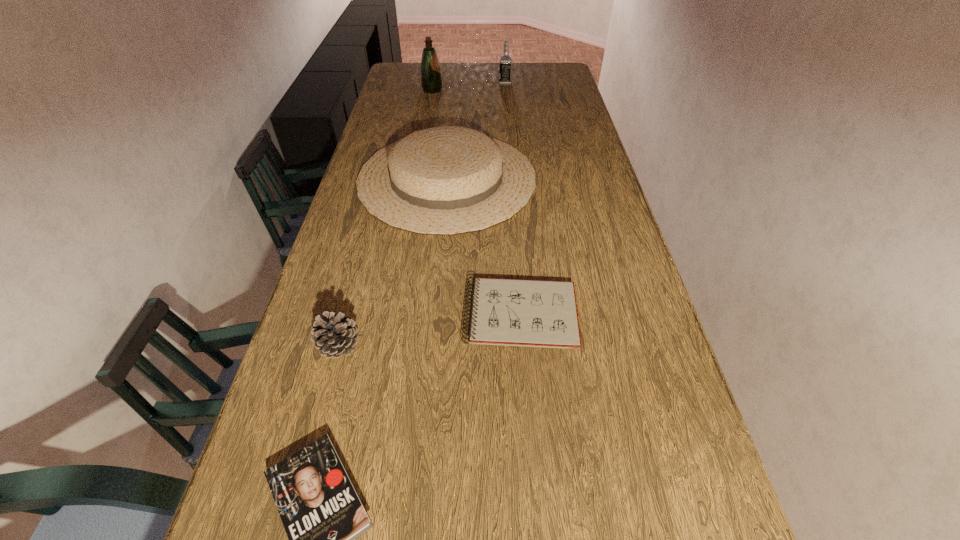
This screenshot has height=540, width=960. I want to click on blank space located 0.380m on the front label of the second tallest object, so click(416, 83).

You are a GUI agent. You are given a task and a screenshot of the screen. Output one action in this format:
    pyautogui.click(x=<x>, y=<y>)
    Task: Click on the free location located on the front of the sunhat
    The width and height of the screenshot is (960, 540).
    Given the screenshot: What is the action you would take?
    point(433,332)

Identify the location of vacant space situated on the front of the pinecone. The width and height of the screenshot is (960, 540). (326, 394).

At what (x,y) coordinates should I click in order to perform the action: click on vacant space located 0.200m on the back of the notepad. Please return your answer as a coordinate pair (x, y). The image size is (960, 540). Looking at the image, I should click on (514, 233).

Identify the location of object that is at the far edge. (505, 66).

Where is `olive oil that is at the left edge`? This screenshot has width=960, height=540. olive oil that is at the left edge is located at coordinates (431, 82).

At what (x,y) coordinates should I click in order to perform the action: click on sunhat situated at the left edge. Please return your answer as a coordinate pair (x, y). Looking at the image, I should click on (447, 180).

The width and height of the screenshot is (960, 540). In order to click on pinecone located at the left edge in this screenshot , I will do `click(335, 335)`.

In the image, there is a desktop. Find the location of `vacant space at the far edge`. vacant space at the far edge is located at coordinates (487, 75).

In the image, there is a desktop. Where is `free region at the left edge`? This screenshot has height=540, width=960. free region at the left edge is located at coordinates (324, 307).